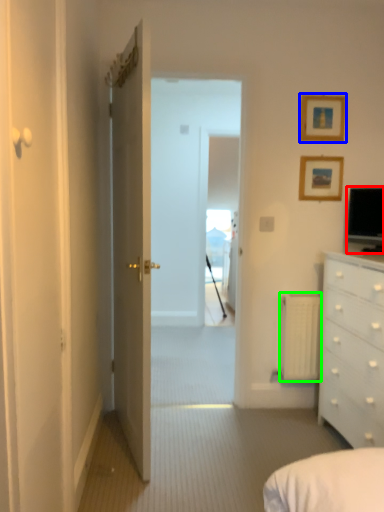
Question: Which object is the farthest from television (highlighted by a red box)? Choose among these: picture frame (highlighted by a blue box) or radiator (highlighted by a green box).

Choices:
 (A) picture frame
 (B) radiator

Answer: (B)